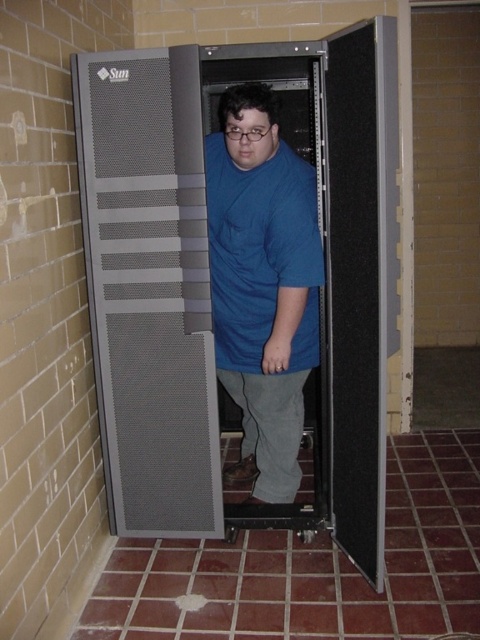
Can you confirm if gray perforated metal server rack at center is smaller than blue cotton shirt at center?

No, gray perforated metal server rack at center is not smaller than blue cotton shirt at center.

Who is more forward, (326, 476) or (277, 307)?

Point (277, 307) is in front.

What do you see at coordinates (208, 278) in the screenshot? Image resolution: width=480 pixels, height=640 pixels. I see `gray perforated metal server rack at center` at bounding box center [208, 278].

This screenshot has width=480, height=640. I want to click on gray perforated metal server rack at center, so click(x=208, y=278).